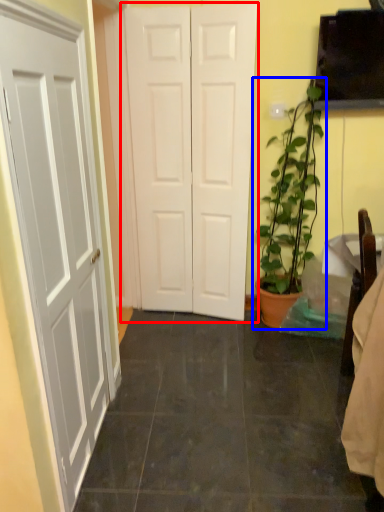
Question: Among these objects, which one is farthest to the camera, door (highlighted by a red box) or houseplant (highlighted by a blue box)?

Choices:
 (A) door
 (B) houseplant

Answer: (A)